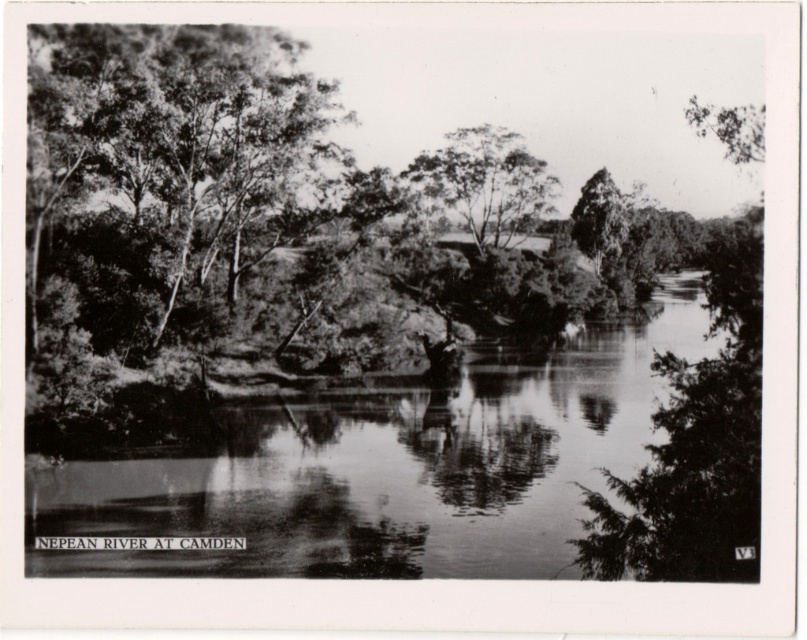
Who is higher up, smooth water at center or smooth bark tree at center?

Positioned higher is smooth bark tree at center.

Can you confirm if smooth water at center is wider than smooth bark tree at center?

Yes.

At what (x,y) coordinates should I click in order to perform the action: click on smooth water at center. Please return your answer as a coordinate pair (x, y). Looking at the image, I should click on (404, 470).